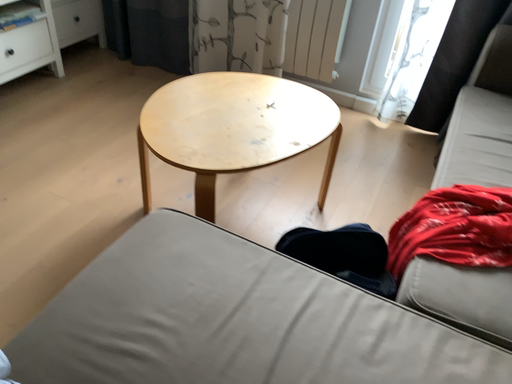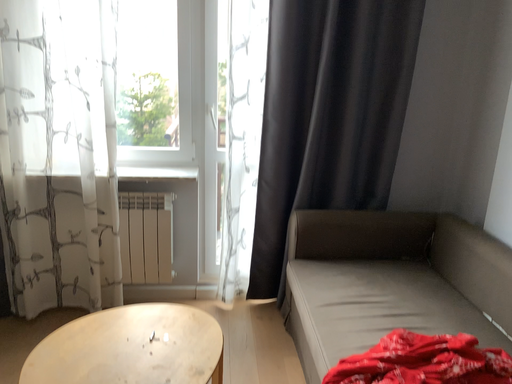
Question: How did the camera likely rotate when shooting the video?

Choices:
 (A) rotated upward
 (B) rotated downward

Answer: (A)